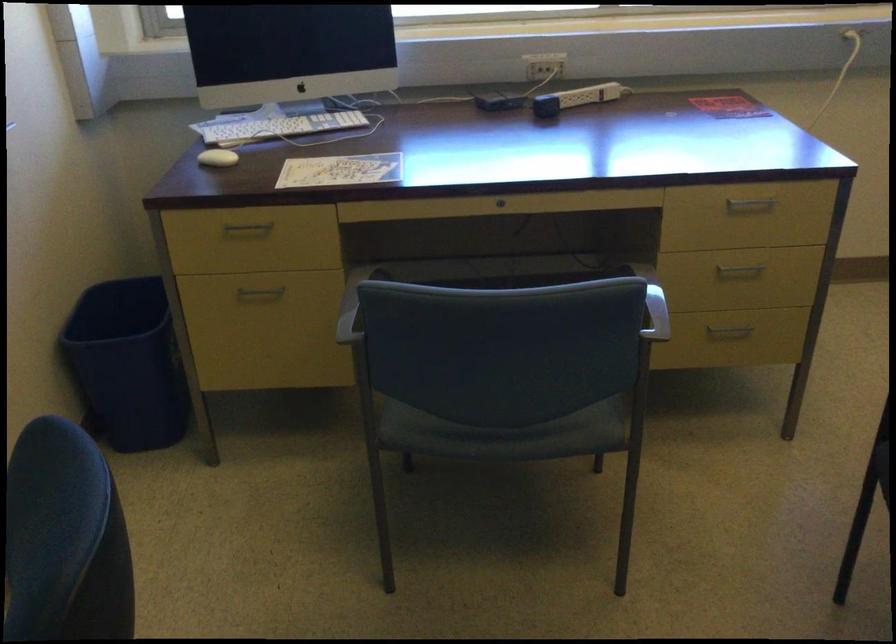
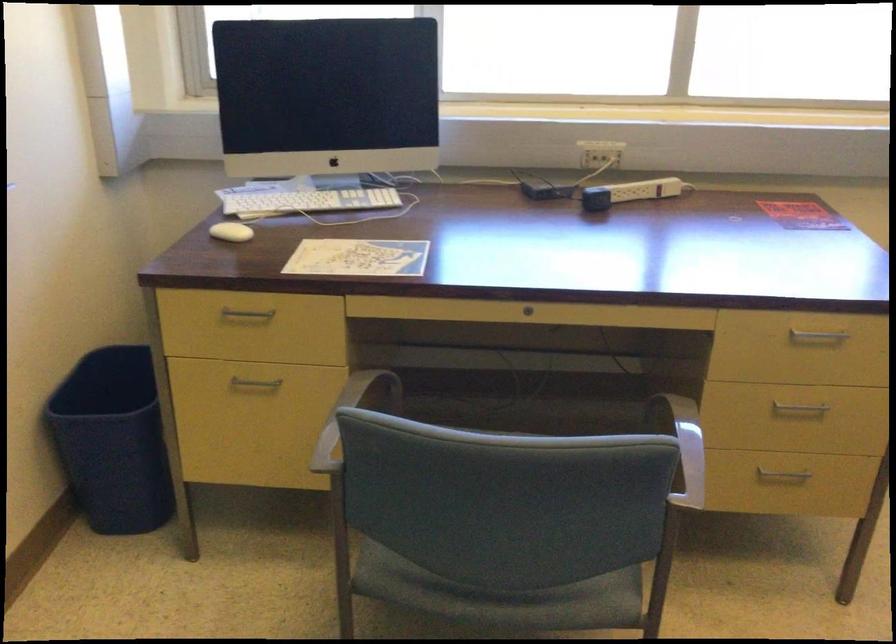
Where in the second image is the point corresponding to point (274, 128) from the first image?

(304, 200)